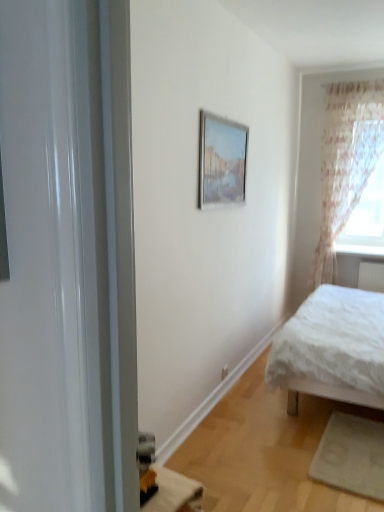
Question: Can white textured bed at right be found inside white glossy window sill at upper right?

Choices:
 (A) yes
 (B) no

Answer: (B)

Question: From the image's perspective, is white glossy window sill at upper right beneath white textured bed at right?

Choices:
 (A) no
 (B) yes

Answer: (A)

Question: Does white glossy window sill at upper right appear on the right side of white textured bed at right?

Choices:
 (A) yes
 (B) no

Answer: (A)

Question: Are white glossy window sill at upper right and white textured bed at right far apart?

Choices:
 (A) yes
 (B) no

Answer: (A)

Question: Is white glossy window sill at upper right next to white textured bed at right and touching it?

Choices:
 (A) yes
 (B) no

Answer: (B)

Question: Is white glossy window sill at upper right facing away from white textured bed at right?

Choices:
 (A) no
 (B) yes

Answer: (A)

Question: From a real-world perspective, is sheer floral fabric at right on matte silver picture frame at upper center?

Choices:
 (A) yes
 (B) no

Answer: (B)

Question: Is sheer floral fabric at right positioned before matte silver picture frame at upper center?

Choices:
 (A) yes
 (B) no

Answer: (B)

Question: Is sheer floral fabric at right further to camera compared to matte silver picture frame at upper center?

Choices:
 (A) no
 (B) yes

Answer: (B)

Question: Is sheer floral fabric at right facing towards matte silver picture frame at upper center?

Choices:
 (A) yes
 (B) no

Answer: (A)

Question: From the image's perspective, would you say sheer floral fabric at right is shown under matte silver picture frame at upper center?

Choices:
 (A) yes
 (B) no

Answer: (A)

Question: Is sheer floral fabric at right in contact with matte silver picture frame at upper center?

Choices:
 (A) yes
 (B) no

Answer: (B)

Question: From a real-world perspective, does white glossy window sill at upper right sit lower than sheer floral fabric at right?

Choices:
 (A) yes
 (B) no

Answer: (A)